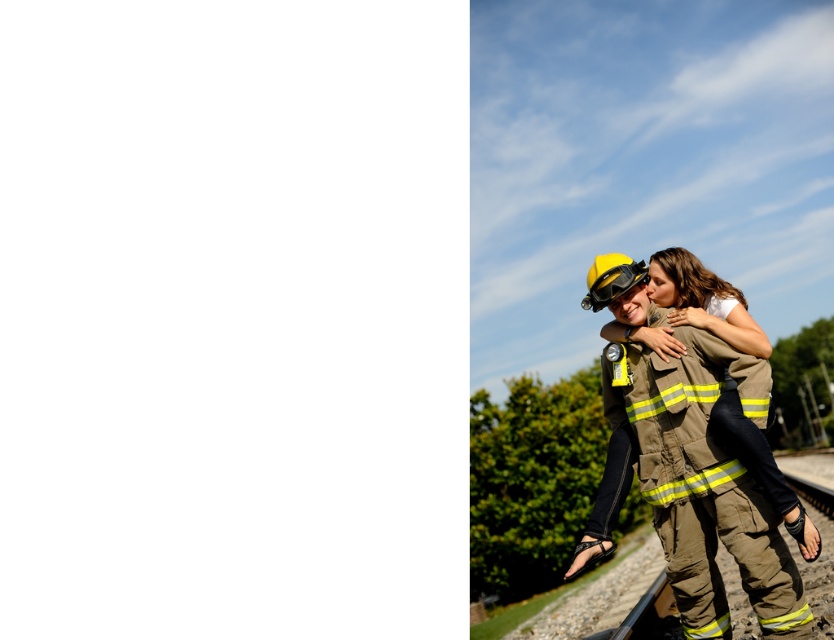
You are a safety inspector checking the equipment setup in the scene. The brown fireman uniform at right and the yellow matte safety goggles at center must be positioned so that the goggles are visible and accessible. Considering their spatial relationship, is the current arrangement compliant with safety standards requiring that the goggles are not obstructed by the uniform?

The brown fireman uniform at right might be wider than yellow matte safety goggles at center, which could potentially block visibility or access to the goggles. This arrangement may not comply with safety standards as the uniform might obstruct the goggles.

You are a safety inspector checking the positioning of equipment on a firefighter. Based on the scene, is the brown fireman uniform at right positioned correctly relative to the yellow matte safety goggles at center according to standard safety protocols?

The brown fireman uniform at right is located below the yellow matte safety goggles at center, which violates standard safety protocols as the goggles should be positioned above the uniform for proper visibility and accessibility.

In the scene shown: You are a photographer positioned at the center of the image. You want to capture a closeup of the brown fireman uniform at right. Based on its 2D coordinates, in which direction should you move your camera to focus on it?

The brown fireman uniform at right is located at coordinates point [704,481]. Since the photographer is at the center, moving the camera to the right and upward will align it with the uniform.